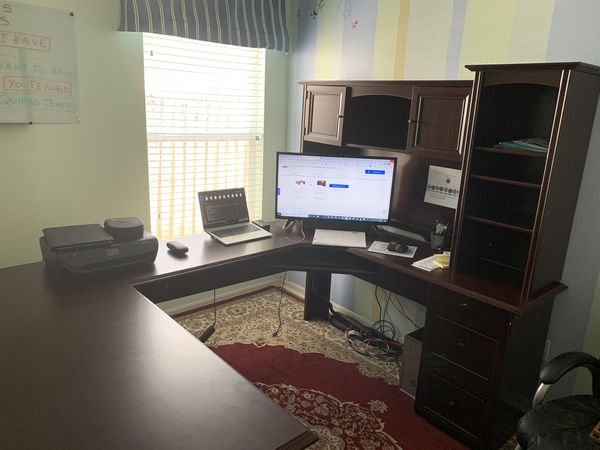
Image resolution: width=600 pixels, height=450 pixels. I want to click on computer monitor, so click(x=368, y=192).